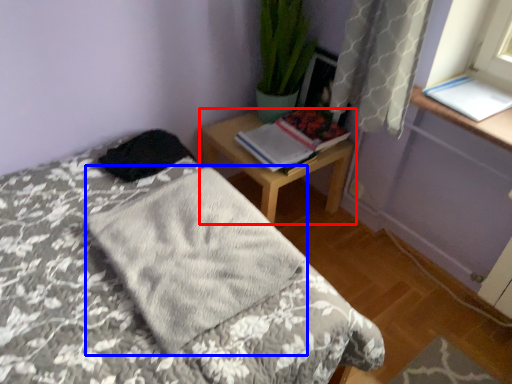
Question: Which of the following is the farthest to the observer, nightstand (highlighted by a red box) or blanket (highlighted by a blue box)?

Choices:
 (A) nightstand
 (B) blanket

Answer: (A)